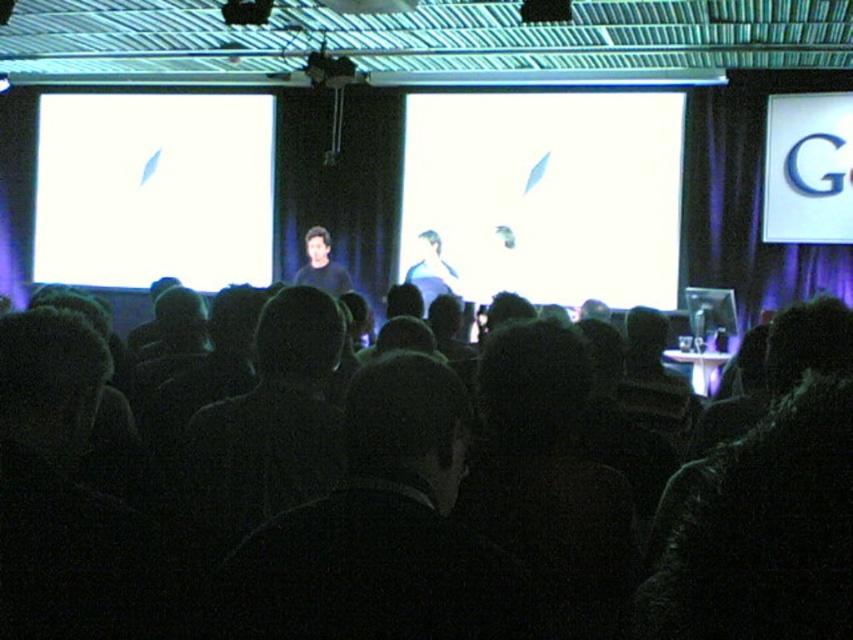
Question: Which point appears closest to the camera in this image?

Choices:
 (A) (309, 248)
 (B) (358, 580)
 (C) (527, 189)
 (D) (543, 19)

Answer: (B)

Question: Considering the relative positions of white matte screen at upper left and black matte speaker at center in the image provided, where is white matte screen at upper left located with respect to black matte speaker at center?

Choices:
 (A) below
 (B) above

Answer: (A)

Question: Which of the following is the farthest from the observer?

Choices:
 (A) (62, 188)
 (B) (672, 490)
 (C) (496, 134)

Answer: (A)

Question: Does white matte projection screen at center appear on the right side of black plastic projector at upper center?

Choices:
 (A) no
 (B) yes

Answer: (B)

Question: Which of the following is the farthest from the observer?

Choices:
 (A) (556, 19)
 (B) (737, 584)
 (C) (328, 282)

Answer: (C)

Question: Can you confirm if black hair at center is thinner than white matte screen at upper left?

Choices:
 (A) no
 (B) yes

Answer: (B)